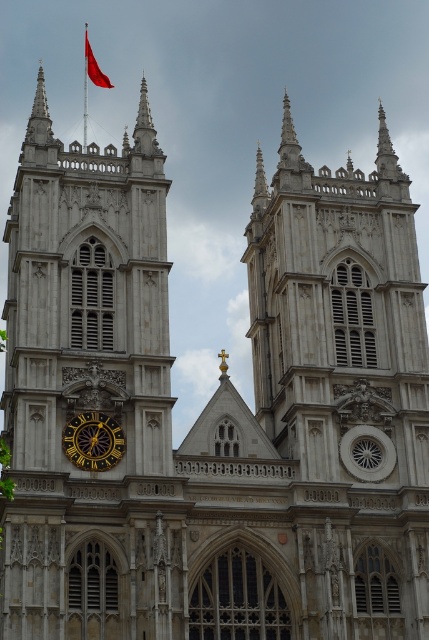
Question: Is gold metallic clock at lower left smaller than smooth red flag at upper left?

Choices:
 (A) yes
 (B) no

Answer: (A)

Question: Which is farther from the stone clock tower at left?

Choices:
 (A) gold metallic clock at lower left
 (B) smooth red flag at upper left

Answer: (B)

Question: Is gold metallic clock at lower left above smooth red flag at upper left?

Choices:
 (A) no
 (B) yes

Answer: (A)

Question: From the image, what is the correct spatial relationship of gold metallic clock at lower left in relation to smooth red flag at upper left?

Choices:
 (A) above
 (B) below

Answer: (B)

Question: Which point is farther to the camera?

Choices:
 (A) smooth red flag at upper left
 (B) stone clock tower at left

Answer: (A)

Question: Which of the following is the closest to the observer?

Choices:
 (A) (90, 67)
 (B) (159, 164)

Answer: (B)